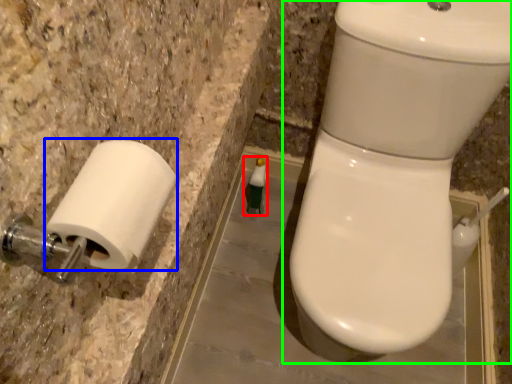
Question: Which is nearer to the toiletry (highlighted by a red box)? toilet paper (highlighted by a blue box) or toilet (highlighted by a green box).

Choices:
 (A) toilet paper
 (B) toilet

Answer: (B)